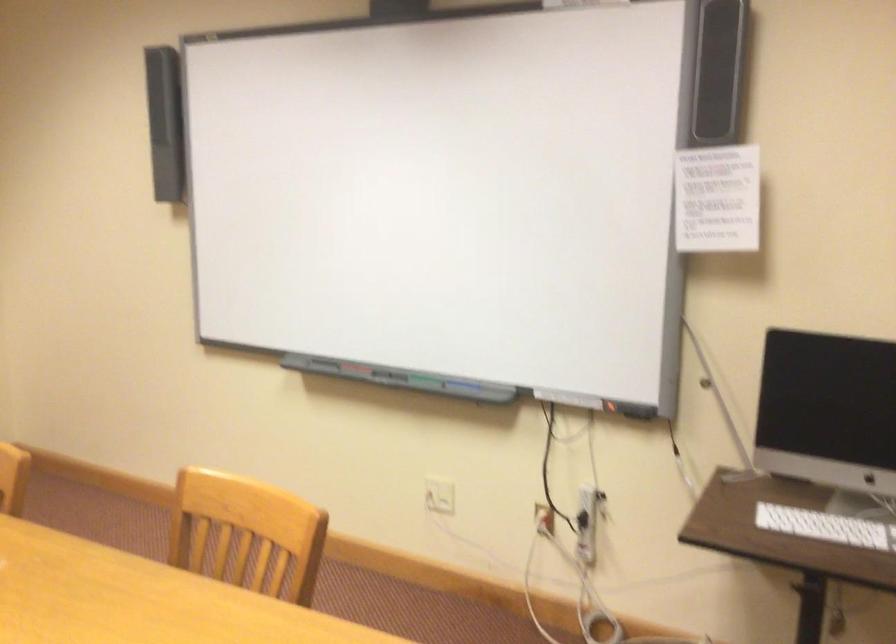
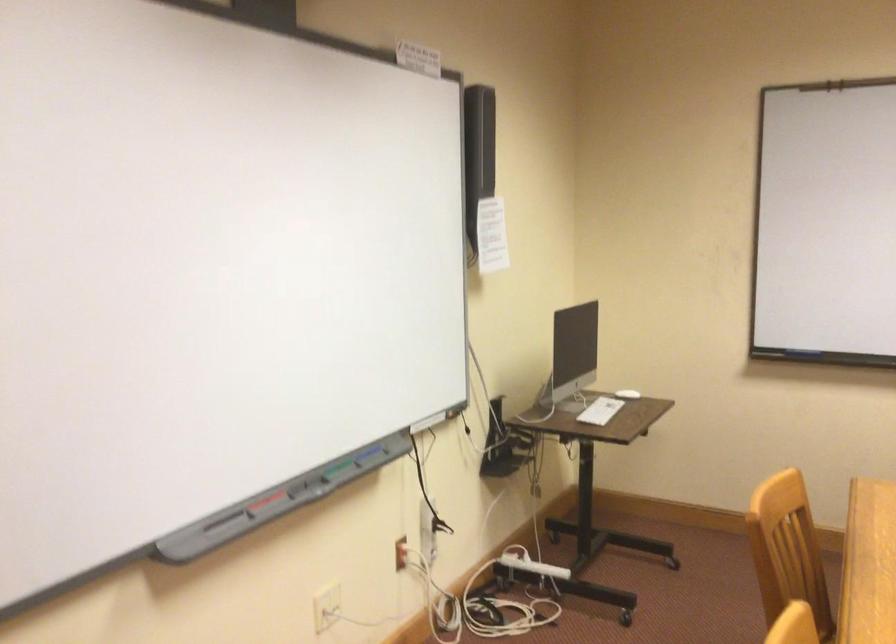
Locate, in the second image, the point that corresponds to the point at 359,370 in the first image.

(264, 502)